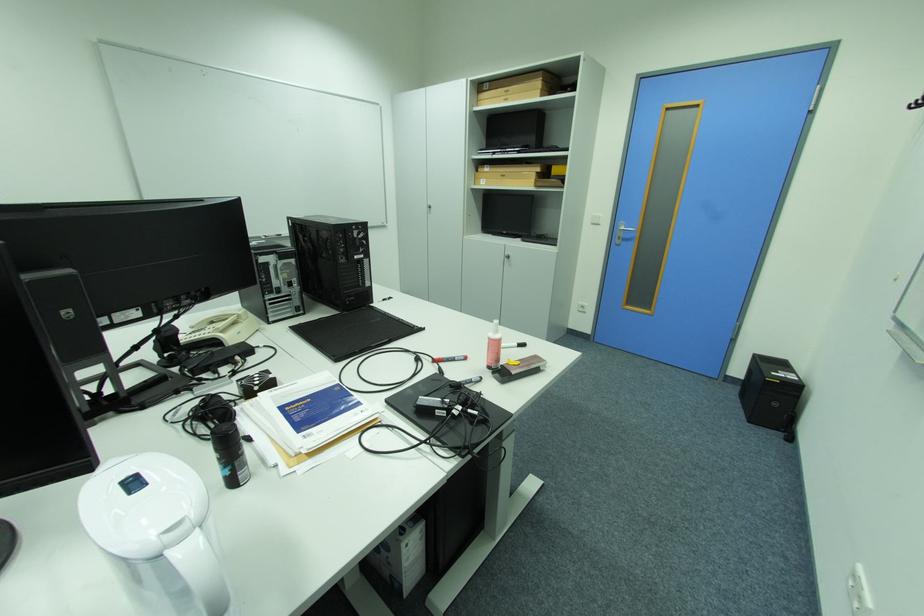
You are a GUI agent. You are given a task and a screenshot of the screen. Output one action in this format:
    pyautogui.click(x=<x>, y=<y>)
    Task: Click on the silver door handle
    The width and height of the screenshot is (924, 616).
    Given the screenshot: What is the action you would take?
    pyautogui.click(x=624, y=228)